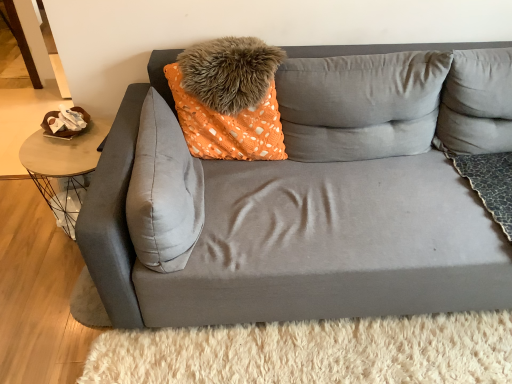
The image size is (512, 384). What do you see at coordinates (164, 191) in the screenshot?
I see `suede gray pillow at center, placed as the fifth pillow when sorted from right to left` at bounding box center [164, 191].

Describe the element at coordinates (64, 168) in the screenshot. I see `metallic wire table at left` at that location.

Measure the distance between metallic wire table at left and camera.

metallic wire table at left and camera are 1.67 meters apart from each other.

The image size is (512, 384). I want to click on fuzzy orange pillow at upper center, which is the third pillow from right to left, so click(229, 72).

What is the approximate width of matte gray couch at center?

matte gray couch at center is 39.34 inches in width.

What do you see at coordinates (113, 217) in the screenshot? I see `matte gray couch at center` at bounding box center [113, 217].

Locate an element on the screen. This screenshot has height=384, width=512. orange dotted fabric pillow at center, which appears as the 4th pillow when viewed from the right is located at coordinates (228, 126).

Which is behind, fuzzy orange pillow at upper center, arranged as the third pillow when viewed from the left, or matte gray couch at center?

Positioned behind is fuzzy orange pillow at upper center, arranged as the third pillow when viewed from the left.

Is point (183, 73) closer to camera compared to point (443, 298)?

That is False.

How different are the orientations of fuzzy orange pillow at upper center, which is the third pillow from right to left, and matte gray couch at center in degrees?

The angular difference between fuzzy orange pillow at upper center, which is the third pillow from right to left, and matte gray couch at center is 1.3 degrees.

Based on the photo, from a real-world perspective, is fuzzy orange pillow at upper center, which is the third pillow from right to left, beneath matte gray couch at center?

No, from a real-world perspective, fuzzy orange pillow at upper center, which is the third pillow from right to left, is not below matte gray couch at center.

From the image's perspective, is gray fabric pillow at upper right, arranged as the 1th pillow when viewed from the right, over matte gray couch at center?

Yes, from the image's perspective, gray fabric pillow at upper right, arranged as the 1th pillow when viewed from the right, is above matte gray couch at center.

In order to click on studio couch in front of the gray fabric pillow at upper right, arranged as the 1th pillow when viewed from the right in this screenshot , I will do `click(113, 217)`.

Would you say matte gray couch at center is part of gray fabric pillow at upper right, arranged as the 1th pillow when viewed from the right,'s contents?

No, gray fabric pillow at upper right, arranged as the 1th pillow when viewed from the right, does not contain matte gray couch at center.

Considering the relative sizes of gray fabric pillow at upper right, the fifth pillow in the left-to-right sequence, and matte gray couch at center in the image provided, is gray fabric pillow at upper right, the fifth pillow in the left-to-right sequence, bigger than matte gray couch at center?

→ Incorrect, gray fabric pillow at upper right, the fifth pillow in the left-to-right sequence, is not larger than matte gray couch at center.

Is matte gray couch at center oriented towards fuzzy orange pillow at upper center, which is the third pillow from right to left?

No.

Can we say matte gray couch at center lies outside fuzzy orange pillow at upper center, arranged as the third pillow when viewed from the left?

Absolutely, matte gray couch at center is external to fuzzy orange pillow at upper center, arranged as the third pillow when viewed from the left.

Can you tell me how much matte gray couch at center and fuzzy orange pillow at upper center, which is the third pillow from right to left, differ in facing direction?

Answer: There is a 1.3-degree angle between the facing directions of matte gray couch at center and fuzzy orange pillow at upper center, which is the third pillow from right to left.

From a real-world perspective, between orange dotted fabric pillow at center, which is the 2th pillow in left-to-right order, and gray fabric pillow at upper right, the fifth pillow in the left-to-right sequence, who is vertically lower?

orange dotted fabric pillow at center, which is the 2th pillow in left-to-right order, from a real-world perspective.

How much distance is there between orange dotted fabric pillow at center, which is the 2th pillow in left-to-right order, and gray fabric pillow at upper right, arranged as the 1th pillow when viewed from the right?

33.38 inches.

From the image's perspective, which object appears higher, orange dotted fabric pillow at center, which is the 2th pillow in left-to-right order, or gray fabric pillow at upper right, arranged as the 1th pillow when viewed from the right?

gray fabric pillow at upper right, arranged as the 1th pillow when viewed from the right.

Is fuzzy orange pillow at upper center, arranged as the third pillow when viewed from the left, next to suede gray pillow at center, the first pillow positioned from the left?

fuzzy orange pillow at upper center, arranged as the third pillow when viewed from the left, is not next to suede gray pillow at center, the first pillow positioned from the left, and they're not touching.

Considering the relative positions of fuzzy orange pillow at upper center, which is the third pillow from right to left, and suede gray pillow at center, the first pillow positioned from the left, in the image provided, is fuzzy orange pillow at upper center, which is the third pillow from right to left, to the left or to the right of suede gray pillow at center, the first pillow positioned from the left,?

Clearly, fuzzy orange pillow at upper center, which is the third pillow from right to left, is on the right of suede gray pillow at center, the first pillow positioned from the left, in the image.

Which point is more forward, (244,76) or (197,193)?

Positioned in front is point (197,193).

Between fuzzy orange pillow at upper center, arranged as the third pillow when viewed from the left, and suede gray pillow at center, the first pillow positioned from the left, which one has less height?

fuzzy orange pillow at upper center, arranged as the third pillow when viewed from the left, is shorter.

From a real-world perspective, does gray fabric pillow at upper right, the fifth pillow in the left-to-right sequence, sit lower than fuzzy orange pillow at upper center, arranged as the third pillow when viewed from the left?

Indeed, from a real-world perspective, gray fabric pillow at upper right, the fifth pillow in the left-to-right sequence, is positioned beneath fuzzy orange pillow at upper center, arranged as the third pillow when viewed from the left.

Are gray fabric pillow at upper right, arranged as the 1th pillow when viewed from the right, and fuzzy orange pillow at upper center, arranged as the third pillow when viewed from the left, far apart?

No, gray fabric pillow at upper right, arranged as the 1th pillow when viewed from the right, is not far away from fuzzy orange pillow at upper center, arranged as the third pillow when viewed from the left.

Is gray fabric pillow at upper right, the fifth pillow in the left-to-right sequence, positioned beyond the bounds of fuzzy orange pillow at upper center, arranged as the third pillow when viewed from the left?

Absolutely, gray fabric pillow at upper right, the fifth pillow in the left-to-right sequence, is external to fuzzy orange pillow at upper center, arranged as the third pillow when viewed from the left.

Which is more to the left, gray fabric pillow at upper right, the fifth pillow in the left-to-right sequence, or fuzzy orange pillow at upper center, arranged as the third pillow when viewed from the left?

fuzzy orange pillow at upper center, arranged as the third pillow when viewed from the left.

In the image, is orange dotted fabric pillow at center, which appears as the 4th pillow when viewed from the right, positioned in front of or behind fuzzy orange pillow at upper center, arranged as the third pillow when viewed from the left?

orange dotted fabric pillow at center, which appears as the 4th pillow when viewed from the right, is positioned closer to the viewer than fuzzy orange pillow at upper center, arranged as the third pillow when viewed from the left.

From the picture: Is orange dotted fabric pillow at center, which appears as the 4th pillow when viewed from the right, oriented away from fuzzy orange pillow at upper center, arranged as the third pillow when viewed from the left?

Yes, orange dotted fabric pillow at center, which appears as the 4th pillow when viewed from the right, is positioned with its back facing fuzzy orange pillow at upper center, arranged as the third pillow when viewed from the left.

From the image's perspective, which one is positioned higher, orange dotted fabric pillow at center, which is the 2th pillow in left-to-right order, or fuzzy orange pillow at upper center, which is the third pillow from right to left?

fuzzy orange pillow at upper center, which is the third pillow from right to left, is shown above in the image.

What's the angular difference between orange dotted fabric pillow at center, which is the 2th pillow in left-to-right order, and fuzzy orange pillow at upper center, which is the third pillow from right to left,'s facing directions?

orange dotted fabric pillow at center, which is the 2th pillow in left-to-right order, and fuzzy orange pillow at upper center, which is the third pillow from right to left, are facing 7.13 degrees away from each other.

At what (x,y) coordinates should I click in order to perform the action: click on studio couch on the right side of fuzzy orange pillow at upper center, which is the third pillow from right to left. Please return your answer as a coordinate pair (x, y). This screenshot has height=384, width=512. Looking at the image, I should click on (113, 217).

Image resolution: width=512 pixels, height=384 pixels. In order to click on studio couch located in front of the gray fabric pillow at upper right, the fifth pillow in the left-to-right sequence in this screenshot , I will do `click(113, 217)`.

From the image, which object appears to be nearer to orange dotted fabric pillow at center, which appears as the 4th pillow when viewed from the right, fuzzy orange pillow at upper center, which is the third pillow from right to left, or suede gray pillow at center, placed as the fifth pillow when sorted from right to left?

fuzzy orange pillow at upper center, which is the third pillow from right to left, is positioned closer to the anchor orange dotted fabric pillow at center, which appears as the 4th pillow when viewed from the right.

Estimate the real-world distances between objects in this image. Which object is further from fuzzy orange pillow at upper center, which is the third pillow from right to left, metallic wire table at left or gray fabric pillow at upper right, arranged as the 1th pillow when viewed from the right?

gray fabric pillow at upper right, arranged as the 1th pillow when viewed from the right, is positioned further to the anchor fuzzy orange pillow at upper center, which is the third pillow from right to left.

Considering their positions, is gray fabric pillow at upper right, arranged as the 1th pillow when viewed from the right, positioned further to matte gray couch at center than suede gray pillow at center, placed as the fifth pillow when sorted from right to left?

gray fabric pillow at upper right, arranged as the 1th pillow when viewed from the right, lies further to matte gray couch at center than the other object.

Considering their positions, is orange dotted fabric pillow at center, which is the 2th pillow in left-to-right order, positioned further to matte gray couch at center than metallic wire table at left?

metallic wire table at left lies further to matte gray couch at center than the other object.

Estimate the real-world distances between objects in this image. Which object is closer to suede gray pillow at center, the first pillow positioned from the left, metallic wire table at left or fuzzy orange pillow at upper center, arranged as the third pillow when viewed from the left?

fuzzy orange pillow at upper center, arranged as the third pillow when viewed from the left, lies closer to suede gray pillow at center, the first pillow positioned from the left, than the other object.

Consider the image. Based on their spatial positions, is metallic wire table at left or matte gray couch at center further from suede gray pillow at center, placed as the fifth pillow when sorted from right to left?

metallic wire table at left.

Based on their spatial positions, is fuzzy orange pillow at upper center, arranged as the third pillow when viewed from the left, or orange dotted fabric pillow at center, which appears as the 4th pillow when viewed from the right, closer to gray fabric pillow at upper right, the fifth pillow in the left-to-right sequence?

orange dotted fabric pillow at center, which appears as the 4th pillow when viewed from the right.

Based on the photo, which object lies nearer to the anchor point matte gray couch at center, fuzzy orange pillow at upper center, arranged as the third pillow when viewed from the left, or suede gray pillow at center, the first pillow positioned from the left?

Among the two, suede gray pillow at center, the first pillow positioned from the left, is located nearer to matte gray couch at center.

Identify the location of studio couch situated between suede gray pillow at center, placed as the fifth pillow when sorted from right to left, and gray fabric pillow at upper right, the fifth pillow in the left-to-right sequence, from left to right. (113, 217).

At what (x,y) coordinates should I click in order to perform the action: click on pillow situated between metallic wire table at left and orange dotted fabric pillow at center, which is the 2th pillow in left-to-right order, from left to right. Please return your answer as a coordinate pair (x, y). The width and height of the screenshot is (512, 384). Looking at the image, I should click on pyautogui.click(x=164, y=191).

Locate an element on the screen. pillow between fuzzy orange pillow at upper center, arranged as the third pillow when viewed from the left, and matte gray couch at center is located at coordinates (360, 105).

Where is `studio couch located between fuzzy orange pillow at upper center, arranged as the third pillow when viewed from the left, and gray fabric pillow at upper right, the fifth pillow in the left-to-right sequence, in the left-right direction`? The height and width of the screenshot is (384, 512). studio couch located between fuzzy orange pillow at upper center, arranged as the third pillow when viewed from the left, and gray fabric pillow at upper right, the fifth pillow in the left-to-right sequence, in the left-right direction is located at coordinates tap(113, 217).